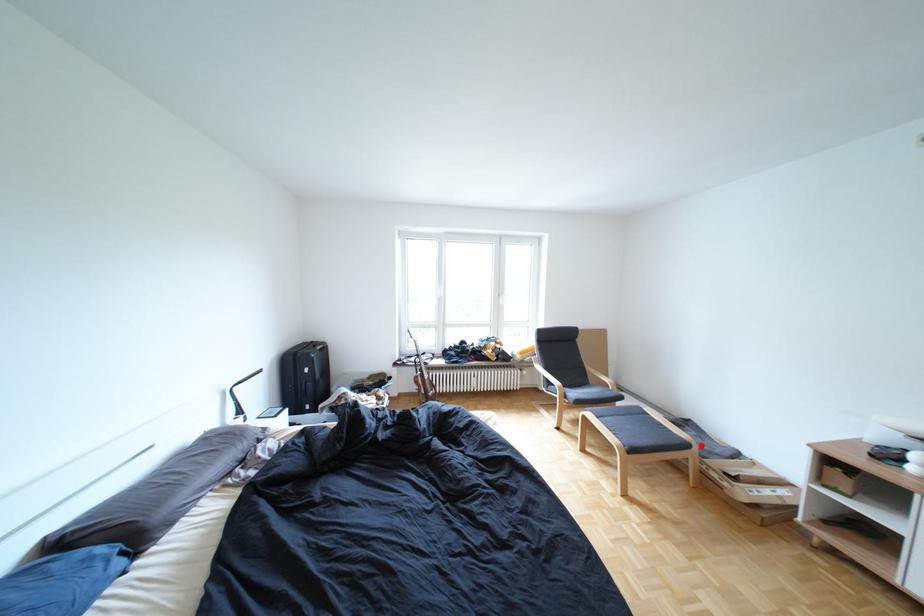
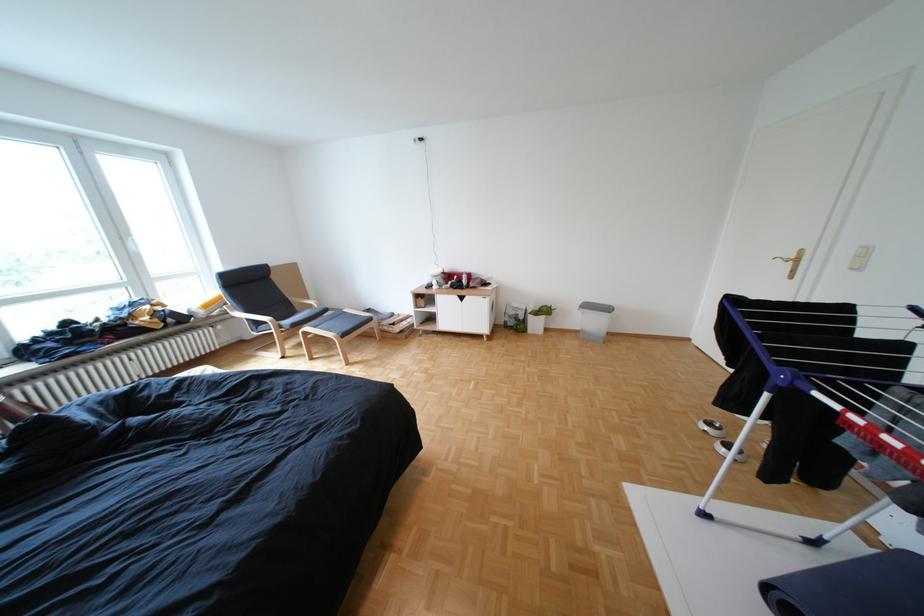
Locate, in the second image, the point that corresponds to the highlighted location in the first image.

(386, 320)